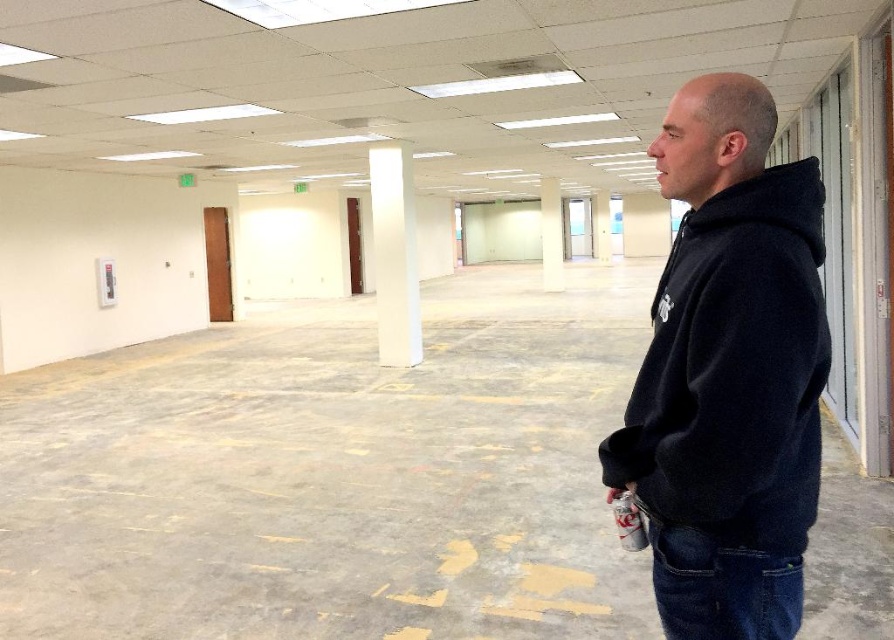
Question: Estimate the real-world distances between objects in this image. Which object is closer to the white smooth pillar at center?

Choices:
 (A) white concrete pillar at center
 (B) white glossy column at center
 (C) black fleece jacket at right

Answer: (A)

Question: Which object is closer to the camera taking this photo?

Choices:
 (A) black fleece jacket at right
 (B) white concrete pillar at center

Answer: (A)

Question: Which point is farther to the camera?

Choices:
 (A) white glossy column at center
 (B) white smooth pillar at center
 (C) white concrete pillar at center
 (D) black fleece jacket at right

Answer: (C)

Question: From the image, what is the correct spatial relationship of black fleece jacket at right in relation to white smooth pillar at center?

Choices:
 (A) below
 (B) above

Answer: (A)

Question: Is white smooth pillar at center closer to camera compared to white concrete pillar at center?

Choices:
 (A) no
 (B) yes

Answer: (B)

Question: Is white glossy column at center to the right of white smooth pillar at center from the viewer's perspective?

Choices:
 (A) yes
 (B) no

Answer: (B)